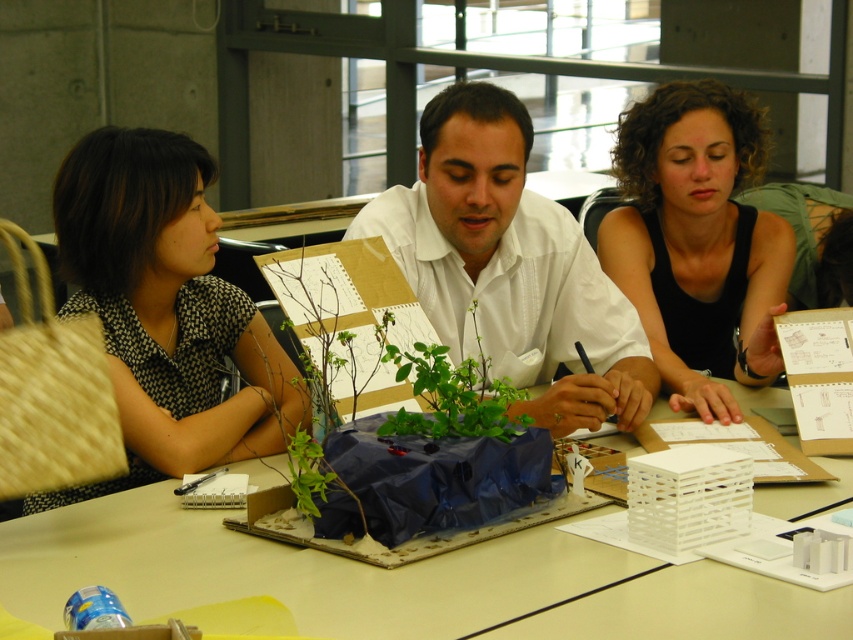
Question: Based on their relative distances, which object is nearer to the black dotted dress at left?

Choices:
 (A) blue plastic bag at center
 (B) black matte tank top at upper right
 (C) green leafy plant at center
 (D) white matte shirt at center

Answer: (A)

Question: Which point is farther from the camera taking this photo?

Choices:
 (A) (212, 317)
 (B) (132, 490)
 (C) (454, 381)
 (D) (721, 349)

Answer: (D)

Question: Where is blue plastic bag at center located in relation to black matte tank top at upper right in the image?

Choices:
 (A) right
 (B) left

Answer: (B)

Question: Considering the real-world distances, which object is closest to the green leafy plant at center?

Choices:
 (A) black matte tank top at upper right
 (B) white matte shirt at center
 (C) black dotted dress at left
 (D) blue plastic bag at center

Answer: (B)

Question: Is blue plastic bag at center to the right of green leafy plant at center from the viewer's perspective?

Choices:
 (A) yes
 (B) no

Answer: (B)

Question: Does blue plastic bag at center appear on the left side of white matte shirt at center?

Choices:
 (A) no
 (B) yes

Answer: (B)